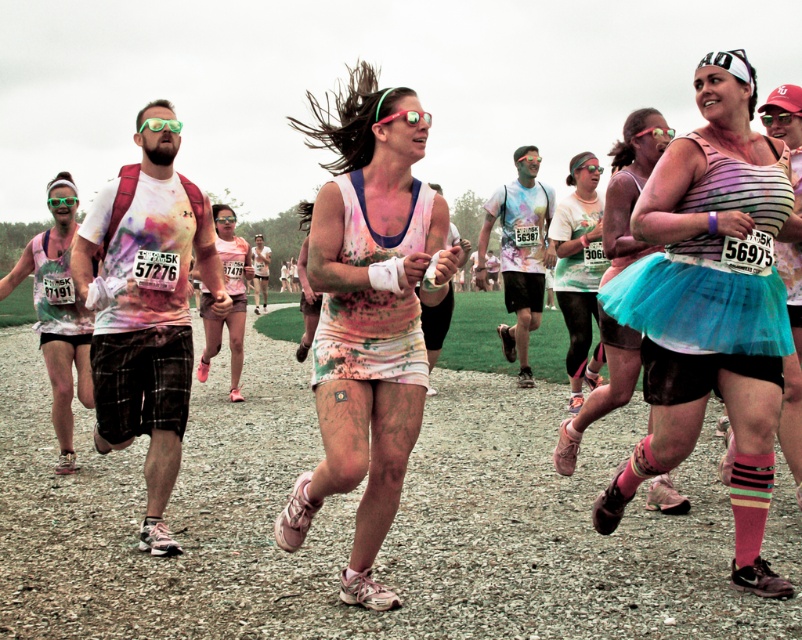
Question: Which of these objects is positioned closest to the rainbow striped tank top at center?

Choices:
 (A) matte white tank top at center
 (B) matte teal tutu skirt at center

Answer: (B)

Question: In this image, where is rainbow striped tank top at center located relative to matte pink tank top at left?

Choices:
 (A) right
 (B) left

Answer: (A)

Question: Is rainbow striped tank top at center to the left of matte teal tutu skirt at center from the viewer's perspective?

Choices:
 (A) no
 (B) yes

Answer: (A)

Question: Can you confirm if matte teal tutu skirt at center is positioned to the right of rainbow striped tutu at center?

Choices:
 (A) yes
 (B) no

Answer: (B)

Question: Among these objects, which one is nearest to the camera?

Choices:
 (A) rainbow striped tank top at center
 (B) matte pink tank top at left
 (C) matte teal tutu skirt at center
 (D) matte green tank top at center

Answer: (A)

Question: Which of the following is the farthest from the observer?

Choices:
 (A) matte white tank top at center
 (B) matte green tank top at center

Answer: (B)